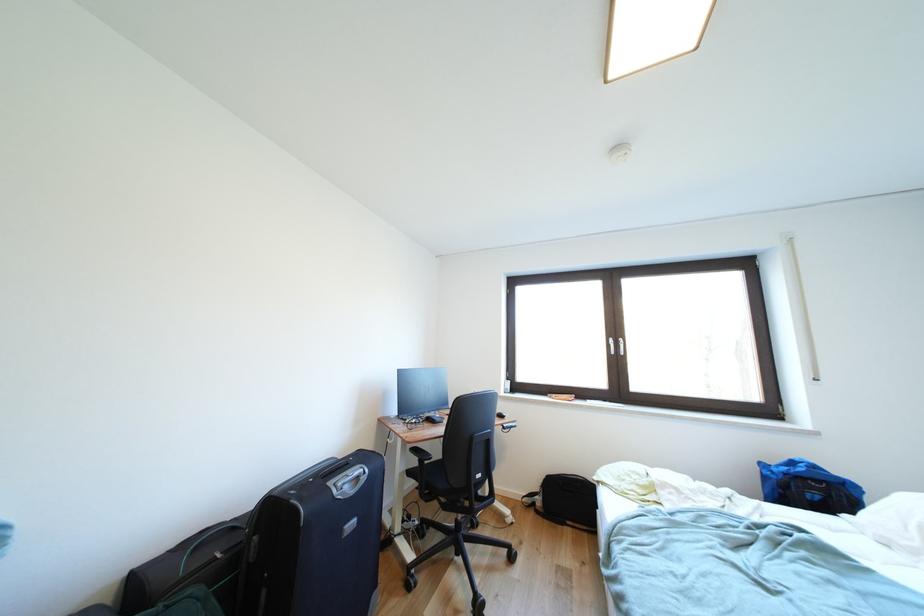
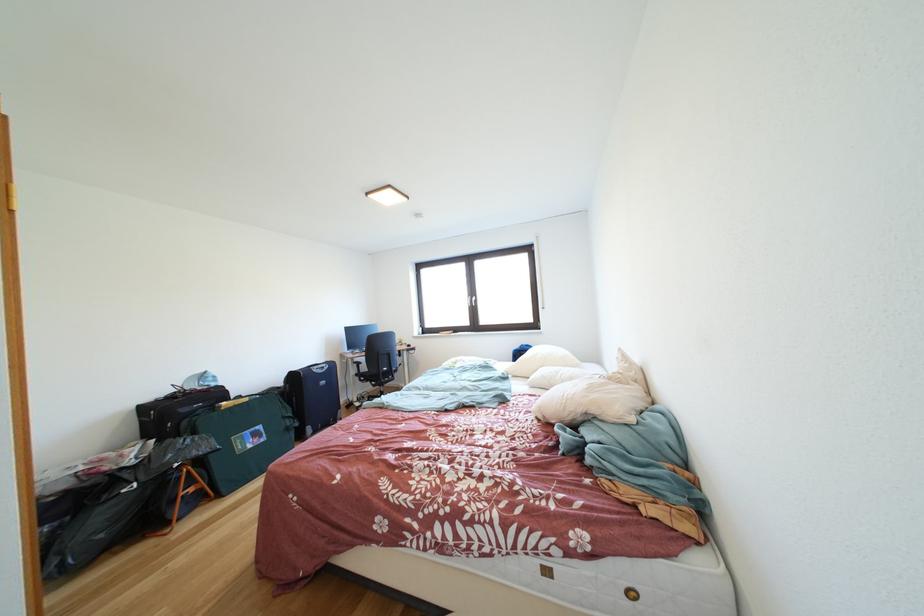
Locate, in the second image, the point that corresponds to [454,512] in the first image.

(383, 391)